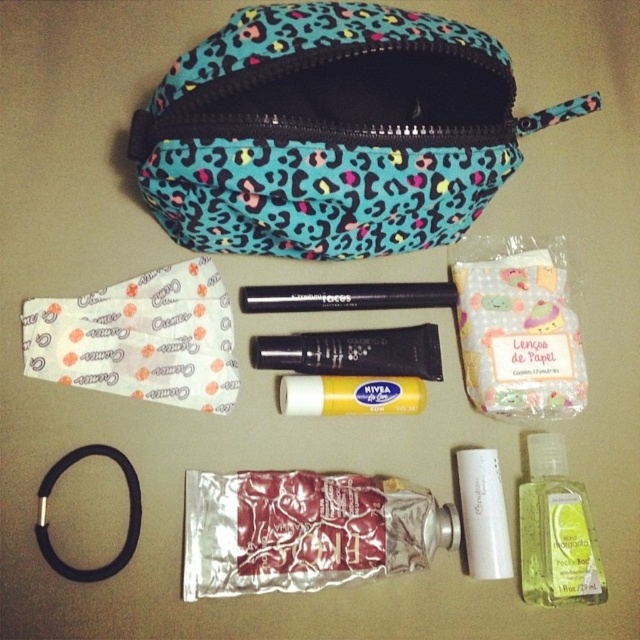
Question: Can you confirm if white paper toothpaste at upper left is thinner than yellow translucent liquid at lower right?

Choices:
 (A) no
 (B) yes

Answer: (A)

Question: Which point is farther from the camera taking this photo?

Choices:
 (A) (556, 404)
 (B) (280, 588)

Answer: (A)

Question: Does blue leopard print pouch at upper center appear on the left side of white paper toothpaste at upper left?

Choices:
 (A) yes
 (B) no

Answer: (B)

Question: Which object is positioned farthest from the white paper toothpaste at upper left?

Choices:
 (A) yellow matte tube at center
 (B) black matte tube at center
 (C) pastel paper tissues at center
 (D) white matte tube at center

Answer: (D)

Question: Which of the following is the farthest from the observer?

Choices:
 (A) (499, 184)
 (B) (538, 497)

Answer: (B)

Question: Does pastel paper tissues at center appear over white matte tube at center?

Choices:
 (A) no
 (B) yes

Answer: (B)